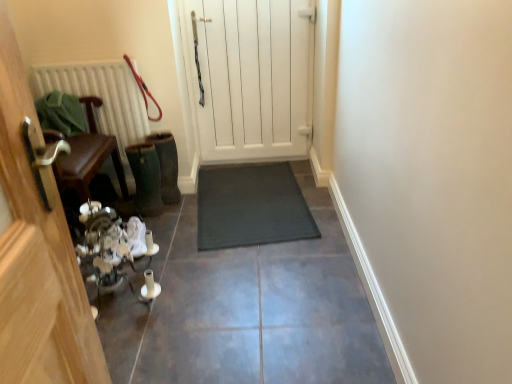
I want to click on free space on the front side of dark gray rubber mat at center, so (260, 283).